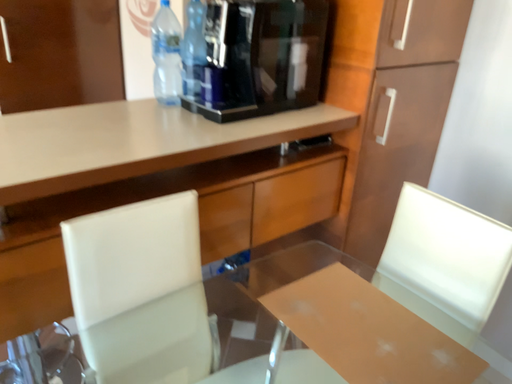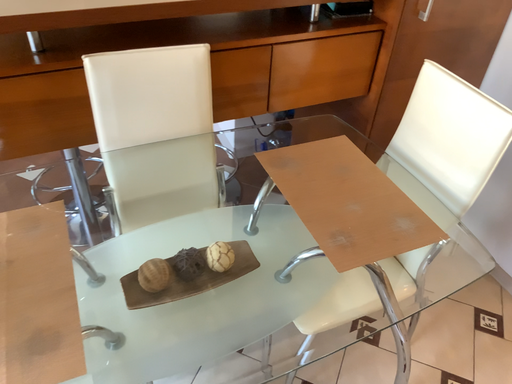
Question: How did the camera likely rotate when shooting the video?

Choices:
 (A) rotated left
 (B) rotated right

Answer: (A)